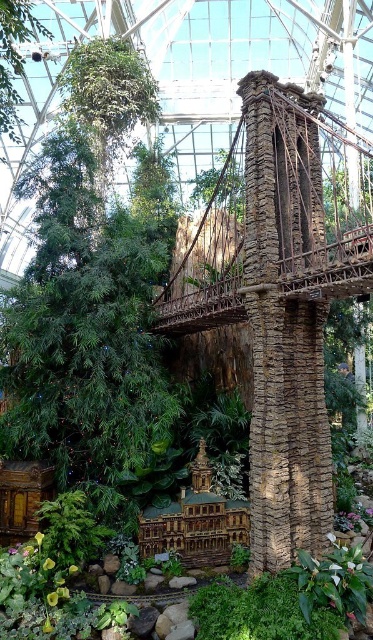
Question: Which object appears farthest from the camera in this image?

Choices:
 (A) green leafy tree at center
 (B) green leafy tree at upper left

Answer: (B)

Question: Does green leafy tree at center appear on the left side of green leafy tree at upper left?

Choices:
 (A) yes
 (B) no

Answer: (B)

Question: Observing the image, what is the correct spatial positioning of green leafy tree at center in reference to green leafy tree at upper left?

Choices:
 (A) below
 (B) above

Answer: (A)

Question: Does green leafy tree at center have a smaller size compared to green leafy tree at upper left?

Choices:
 (A) no
 (B) yes

Answer: (A)